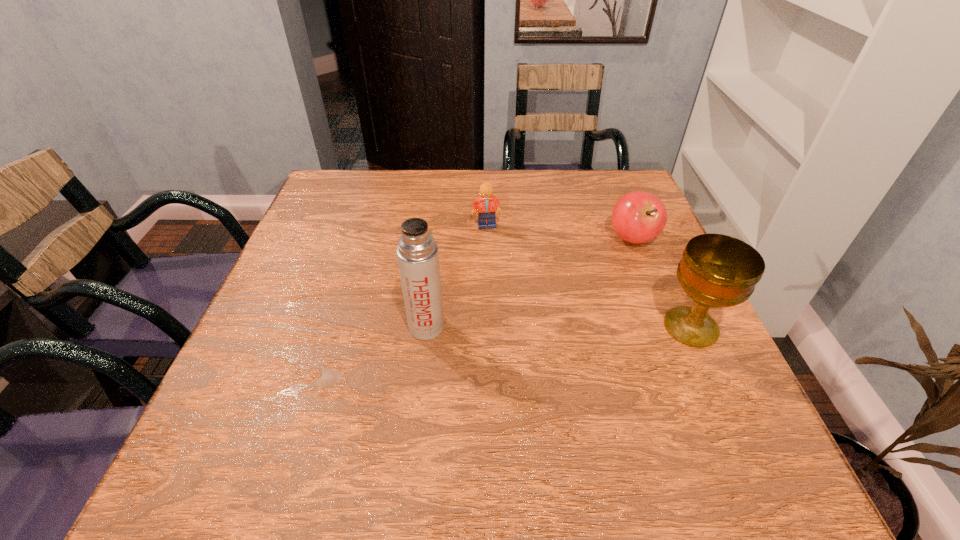
You are a GUI agent. You are given a task and a screenshot of the screen. Output one action in this format:
    pyautogui.click(x=<x>, y=<y>)
    Task: Click on the free space at the near right corner
    
    Given the screenshot: What is the action you would take?
    pyautogui.click(x=673, y=418)

I want to click on free space between the second object from left to right and the tallest object, so click(456, 276).

What are the coordinates of `vacant space that is in between the apple and the second tallest object` in the screenshot? It's located at (661, 283).

Locate an element on the screen. The width and height of the screenshot is (960, 540). free space between the second tallest object and the apple is located at coordinates (661, 283).

The width and height of the screenshot is (960, 540). I want to click on vacant region between the chalice and the apple, so click(661, 283).

You are a GUI agent. You are given a task and a screenshot of the screen. Output one action in this format:
    pyautogui.click(x=<x>, y=<y>)
    Task: Click on the unoccupied position between the apple and the third shortest object
    This screenshot has width=960, height=540.
    Given the screenshot: What is the action you would take?
    [x=661, y=283]

Locate an element on the screen. This screenshot has width=960, height=540. free space between the leftmost object and the apple is located at coordinates (530, 282).

Locate an element on the screen. This screenshot has width=960, height=540. free space between the chalice and the thermos bottle is located at coordinates (559, 327).

Find the location of a particular element. The image size is (960, 540). free area in between the chalice and the leftmost object is located at coordinates (559, 327).

What are the coordinates of `empty space between the tallest object and the apple` in the screenshot? It's located at [530, 282].